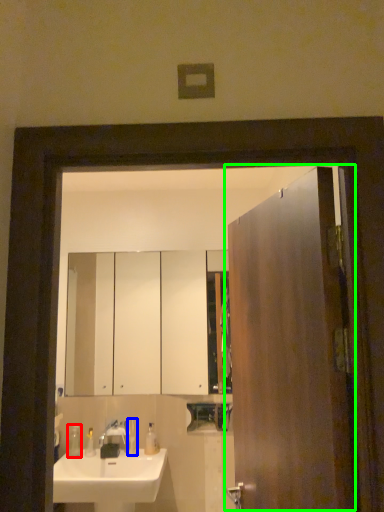
Question: Which object is the farthest from soap dispenser (highlighted by a red box)? Choose among these: toiletry (highlighted by a blue box) or door (highlighted by a green box).

Choices:
 (A) toiletry
 (B) door

Answer: (B)